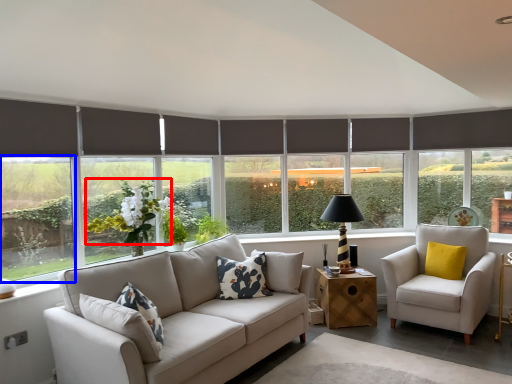
Question: Which object appears farthest to the camera in this image, flower (highlighted by a red box) or window screen (highlighted by a blue box)?

Choices:
 (A) flower
 (B) window screen

Answer: (A)